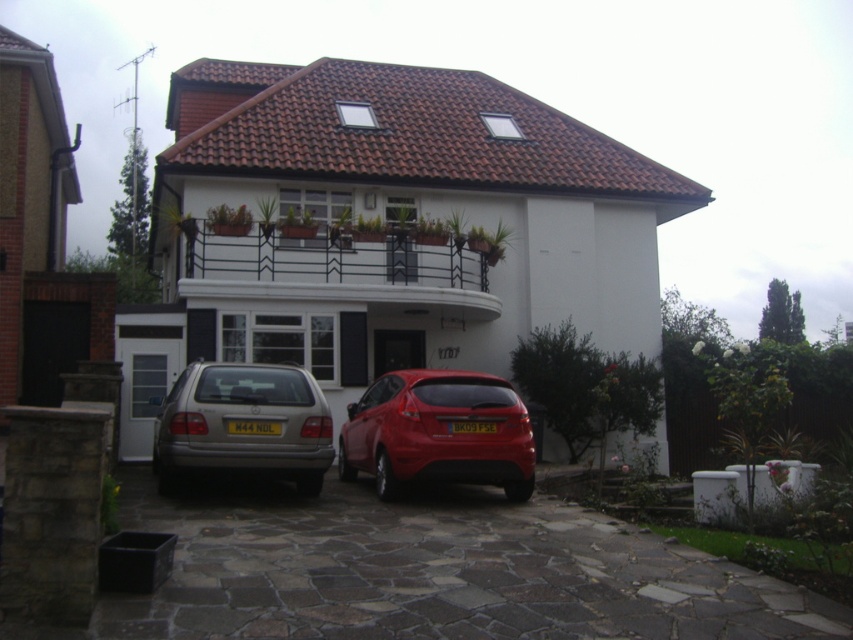
Question: Is brown stone driveway at center below satin silver car at lower left?

Choices:
 (A) no
 (B) yes

Answer: (B)

Question: Which point is closer to the camera?

Choices:
 (A) glossy metallic hatchback at center
 (B) yellow plastic license plate at center
 (C) brown stone driveway at center
 (D) satin silver car at lower left

Answer: (C)

Question: Is brown stone driveway at center further to camera compared to yellow matte license plate at center?

Choices:
 (A) no
 (B) yes

Answer: (A)

Question: Which of the following is the farthest from the observer?

Choices:
 (A) glossy metallic hatchback at center
 (B) brown stone driveway at center
 (C) yellow matte license plate at center

Answer: (A)

Question: Which point is closer to the camera?

Choices:
 (A) (273, 432)
 (B) (473, 420)
 (C) (312, 440)

Answer: (A)

Question: Is brown stone driveway at center below glossy metallic hatchback at center?

Choices:
 (A) no
 (B) yes

Answer: (B)